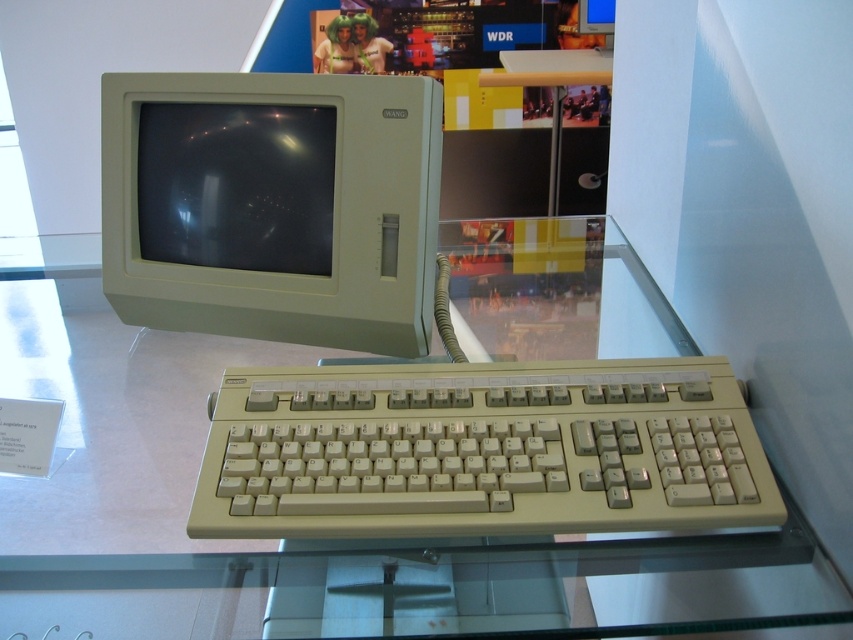
Question: Can you confirm if beige plastic keyboard at center is bigger than beige plastic monitor at upper left?

Choices:
 (A) no
 (B) yes

Answer: (A)

Question: Which point is farther from the camera taking this photo?

Choices:
 (A) (265, 246)
 (B) (717, 577)

Answer: (A)

Question: Which object appears closest to the camera in this image?

Choices:
 (A) matte plastic monitor at upper left
 (B) clear glass table at center
 (C) beige plastic keyboard at center

Answer: (B)

Question: Can you confirm if clear glass table at center is positioned below beige plastic keyboard at center?

Choices:
 (A) yes
 (B) no

Answer: (B)

Question: Estimate the real-world distances between objects in this image. Which object is closer to the clear glass table at center?

Choices:
 (A) beige plastic monitor at upper left
 (B) beige plastic keyboard at center

Answer: (B)

Question: Does beige plastic monitor at upper left appear under matte plastic monitor at upper left?

Choices:
 (A) no
 (B) yes

Answer: (B)